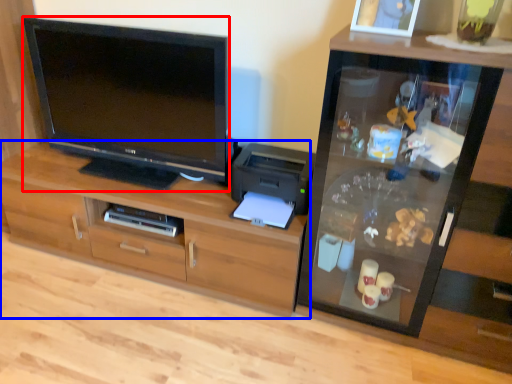
Question: Which object is closer to the camera taking this photo, television (highlighted by a red box) or cabinetry (highlighted by a blue box)?

Choices:
 (A) television
 (B) cabinetry

Answer: (A)